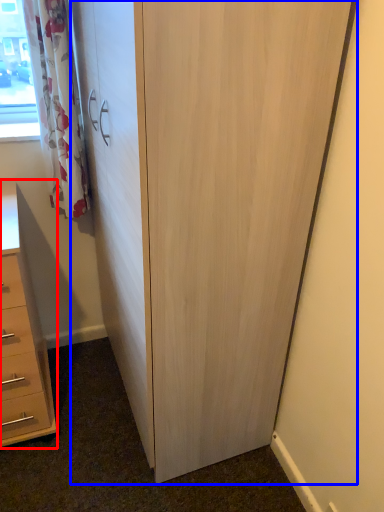
Question: Which of the following is the farthest to the observer, chest of drawers (highlighted by a red box) or cupboard (highlighted by a blue box)?

Choices:
 (A) chest of drawers
 (B) cupboard

Answer: (A)